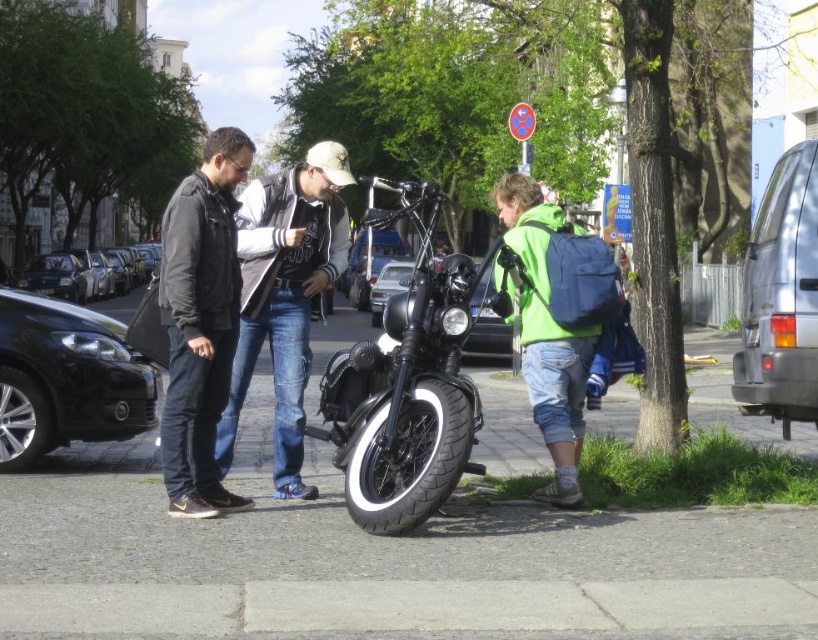
Question: Which object is the closest to the black glossy car at left?

Choices:
 (A) gray concrete pavement at lower center
 (B) black leather jacket at left
 (C) black matte motorcycle at center

Answer: (C)

Question: Which of the following is the closest to the observer?

Choices:
 (A) (499, 192)
 (B) (300, 360)
 (C) (808, 259)
 (D) (129, 276)

Answer: (B)

Question: Which point appears closest to the camera in this image?

Choices:
 (A) (387, 508)
 (B) (149, 387)
 (C) (209, 417)
 (D) (86, 278)

Answer: (A)

Question: Can you confirm if black leather jacket at left is smaller than black glossy car at left?

Choices:
 (A) no
 (B) yes

Answer: (B)

Question: Can you confirm if gray concrete pavement at lower center is smaller than black leather jacket at left?

Choices:
 (A) yes
 (B) no

Answer: (A)

Question: Can you confirm if gray concrete pavement at lower center is positioned below green matte jacket at right?

Choices:
 (A) yes
 (B) no

Answer: (A)